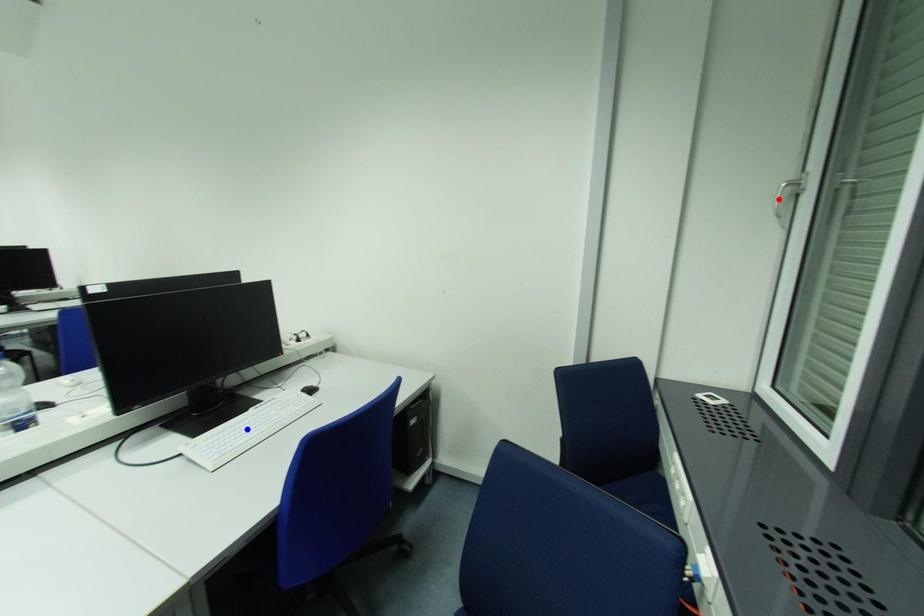
Question: Two points are marked on the image. Which point is closer to the camera?

Choices:
 (A) Blue point is closer.
 (B) Red point is closer.

Answer: (B)